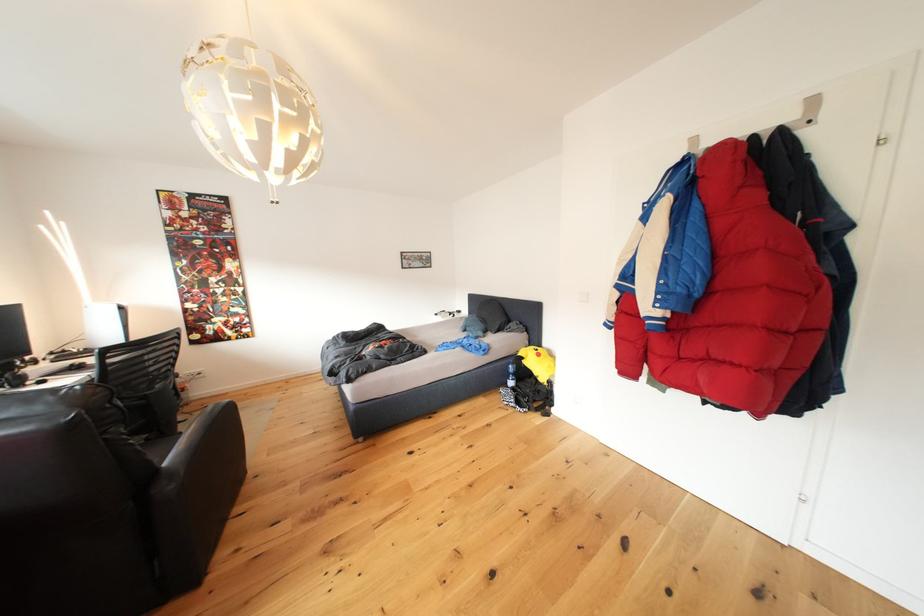
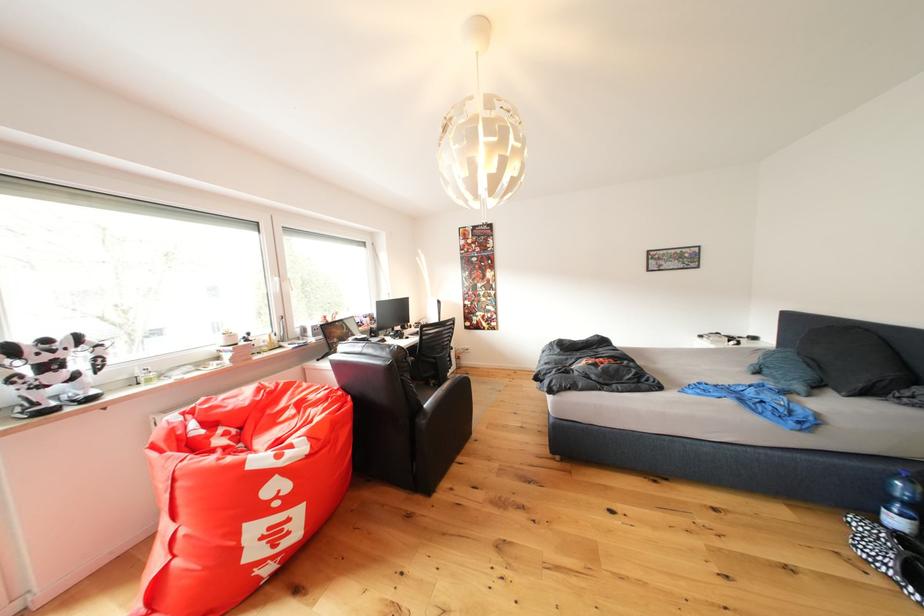
Locate, in the second image, the point that corresponds to point (512, 395) in the first image.

(864, 527)